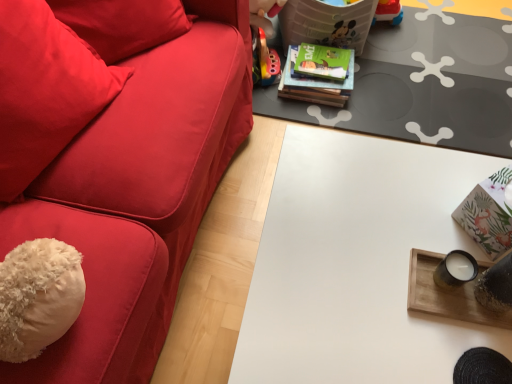
The width and height of the screenshot is (512, 384). Identify the location of vacant space behind wooden tray at right, the second table in the bottom-to-top sequence. (438, 194).